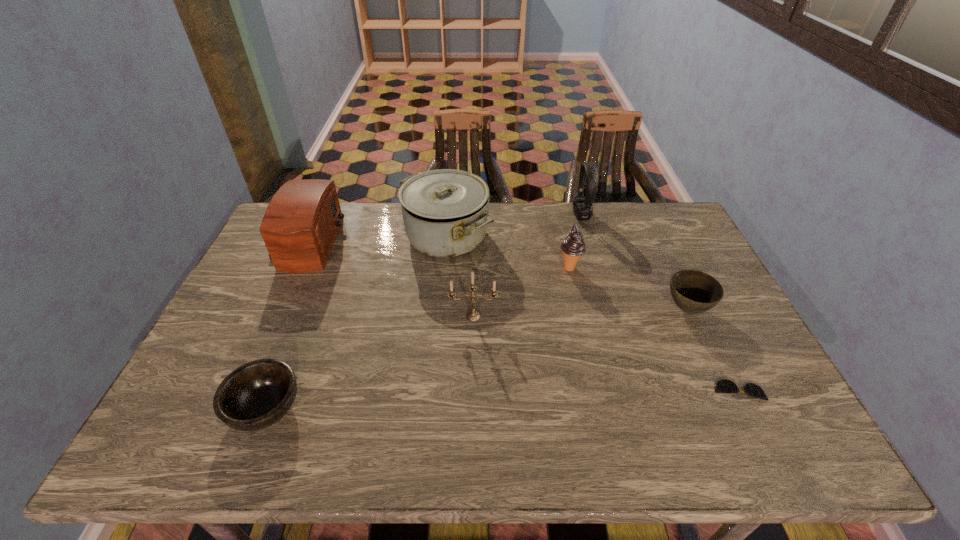
Where is `headset`? headset is located at coordinates (583, 207).

This screenshot has width=960, height=540. Find the location of `saucepan`. saucepan is located at coordinates (446, 212).

You are a GUI agent. You are given a task and a screenshot of the screen. Output one action in this format:
    pyautogui.click(x=<x>, y=<y>)
    Task: Click on the radio receiver
    The height and width of the screenshot is (540, 960).
    Given the screenshot: What is the action you would take?
    pyautogui.click(x=300, y=225)

Identify the location of candle. This screenshot has height=540, width=960. (473, 316).

Where is `the fifth object from left to right`? This screenshot has height=540, width=960. the fifth object from left to right is located at coordinates (573, 246).

Identify the location of the right bowl. This screenshot has height=540, width=960. (693, 291).

This screenshot has width=960, height=540. Find the location of `the shorter bowl`. the shorter bowl is located at coordinates (256, 395).

Where is `the nearer bowl`? This screenshot has height=540, width=960. the nearer bowl is located at coordinates (256, 395).

You are a GUI agent. You are given a task and a screenshot of the screen. Output one action in this format:
    pyautogui.click(x=<x>, y=<y>)
    Task: Click on the shortest object
    The width and height of the screenshot is (960, 540).
    Given the screenshot: What is the action you would take?
    pyautogui.click(x=723, y=386)

I want to click on vacant position located on the front-facing side of the sixth object from left to right, so coord(554,215).